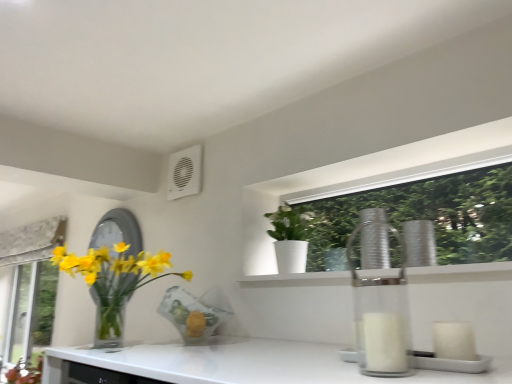
What is the approximate height of translucent glass vase at left, the 1th houseplant positioned from the left?

translucent glass vase at left, the 1th houseplant positioned from the left, is 12.51 inches in height.

You are a GUI agent. You are given a task and a screenshot of the screen. Output one action in this format:
    pyautogui.click(x=<x>, y=<y>)
    Task: Click on the translucent glass vase at left, the 1th houseplant positioned from the left
    
    Given the screenshot: What is the action you would take?
    pyautogui.click(x=114, y=278)

The image size is (512, 384). What are the coordinates of `white plastic air conditioning unit at upper center` in the screenshot? It's located at (184, 173).

Considering the relative sizes of white matte pot at upper center, marked as the second houseplant in a left-to-right arrangement, and translucent glass vase at left, the 1th houseplant positioned from the left, in the image provided, is white matte pot at upper center, marked as the second houseplant in a left-to-right arrangement, smaller than translucent glass vase at left, the 1th houseplant positioned from the left,?

Yes.

How far apart are white matte pot at upper center, which ranks as the 1th houseplant in right-to-left order, and translucent glass vase at left, positioned as the 2th houseplant in right-to-left order?

white matte pot at upper center, which ranks as the 1th houseplant in right-to-left order, is 54.74 centimeters away from translucent glass vase at left, positioned as the 2th houseplant in right-to-left order.

Consider the image. Is white matte pot at upper center, which ranks as the 1th houseplant in right-to-left order, next to translucent glass vase at left, the 1th houseplant positioned from the left?

No, white matte pot at upper center, which ranks as the 1th houseplant in right-to-left order, is not with translucent glass vase at left, the 1th houseplant positioned from the left.

From the image's perspective, between white matte pot at upper center, marked as the second houseplant in a left-to-right arrangement, and translucent glass vase at left, the 1th houseplant positioned from the left, which one is located above?

From the image's view, white matte pot at upper center, marked as the second houseplant in a left-to-right arrangement, is above.

Looking at this image, which is closer, [113,221] or [184,166]?

Point [113,221].

Is silver metallic mirror at left oriented towards white plastic air conditioning unit at upper center?

No, silver metallic mirror at left is not oriented towards white plastic air conditioning unit at upper center.

Considering the sizes of objects silver metallic mirror at left and white plastic air conditioning unit at upper center in the image provided, who is wider, silver metallic mirror at left or white plastic air conditioning unit at upper center?

silver metallic mirror at left is wider.

From the picture: How distant is silver metallic mirror at left from white plastic air conditioning unit at upper center?

silver metallic mirror at left and white plastic air conditioning unit at upper center are 43.72 centimeters apart from each other.

How many degrees apart are the facing directions of white matte pot at upper center, marked as the second houseplant in a left-to-right arrangement, and white plastic air conditioning unit at upper center?

There is a 0.00695-degree angle between the facing directions of white matte pot at upper center, marked as the second houseplant in a left-to-right arrangement, and white plastic air conditioning unit at upper center.

Is white matte pot at upper center, marked as the second houseplant in a left-to-right arrangement, at the right side of white plastic air conditioning unit at upper center?

Yes.

Is white matte pot at upper center, which ranks as the 1th houseplant in right-to-left order, facing towards white plastic air conditioning unit at upper center?

No, white matte pot at upper center, which ranks as the 1th houseplant in right-to-left order, is not facing towards white plastic air conditioning unit at upper center.

How many degrees apart are the facing directions of translucent glass vase at left, the 1th houseplant positioned from the left, and white plastic air conditioning unit at upper center?

They differ by 0.00631 degrees in their facing directions.

In terms of width, does translucent glass vase at left, positioned as the 2th houseplant in right-to-left order, look wider or thinner when compared to white plastic air conditioning unit at upper center?

translucent glass vase at left, positioned as the 2th houseplant in right-to-left order, is wider than white plastic air conditioning unit at upper center.

In the scene shown: Would you say translucent glass vase at left, positioned as the 2th houseplant in right-to-left order, contains white plastic air conditioning unit at upper center?

No, white plastic air conditioning unit at upper center is not inside translucent glass vase at left, positioned as the 2th houseplant in right-to-left order.

From the image's perspective, is translucent glass vase at left, positioned as the 2th houseplant in right-to-left order, under white plastic air conditioning unit at upper center?

Yes, from the image's perspective, translucent glass vase at left, positioned as the 2th houseplant in right-to-left order, is beneath white plastic air conditioning unit at upper center.

From the image's perspective, which is above, silver metallic mirror at left or white matte pot at upper center, which ranks as the 1th houseplant in right-to-left order?

white matte pot at upper center, which ranks as the 1th houseplant in right-to-left order, appears higher in the image.

Locate an element on the screen. houseplant that appears above the silver metallic mirror at left (from a real-world perspective) is located at coordinates (292, 236).

Considering the positions of objects silver metallic mirror at left and white matte pot at upper center, which ranks as the 1th houseplant in right-to-left order, in the image provided, who is more to the left, silver metallic mirror at left or white matte pot at upper center, which ranks as the 1th houseplant in right-to-left order,?

From the viewer's perspective, silver metallic mirror at left appears more on the left side.

Would you say silver metallic mirror at left is a long distance from white matte pot at upper center, which ranks as the 1th houseplant in right-to-left order?

Actually, silver metallic mirror at left and white matte pot at upper center, which ranks as the 1th houseplant in right-to-left order, are a little close together.

Which of these two, white plastic air conditioning unit at upper center or white matte pot at upper center, marked as the second houseplant in a left-to-right arrangement, stands taller?

white matte pot at upper center, marked as the second houseplant in a left-to-right arrangement, is taller.

Considering the sizes of objects white plastic air conditioning unit at upper center and white matte pot at upper center, which ranks as the 1th houseplant in right-to-left order, in the image provided, who is smaller, white plastic air conditioning unit at upper center or white matte pot at upper center, which ranks as the 1th houseplant in right-to-left order,?

white plastic air conditioning unit at upper center.

Is white plastic air conditioning unit at upper center facing away from white matte pot at upper center, marked as the second houseplant in a left-to-right arrangement?

No.

Between white plastic air conditioning unit at upper center and white matte pot at upper center, which ranks as the 1th houseplant in right-to-left order, which one appears on the right side from the viewer's perspective?

white matte pot at upper center, which ranks as the 1th houseplant in right-to-left order.

Do you think white plastic air conditioning unit at upper center is within translucent glass vase at left, the 1th houseplant positioned from the left, or outside of it?

white plastic air conditioning unit at upper center exists outside the volume of translucent glass vase at left, the 1th houseplant positioned from the left.

In order to click on the 2nd houseplant positioned below the white plastic air conditioning unit at upper center (from the image's perspective) in this screenshot , I will do `click(114, 278)`.

Considering the positions of objects white plastic air conditioning unit at upper center and translucent glass vase at left, positioned as the 2th houseplant in right-to-left order, in the image provided, who is more to the right, white plastic air conditioning unit at upper center or translucent glass vase at left, positioned as the 2th houseplant in right-to-left order,?

From the viewer's perspective, white plastic air conditioning unit at upper center appears more on the right side.

Are white plastic air conditioning unit at upper center and translucent glass vase at left, positioned as the 2th houseplant in right-to-left order, beside each other?

white plastic air conditioning unit at upper center and translucent glass vase at left, positioned as the 2th houseplant in right-to-left order, are not in contact.

Where is `houseplant located above the translucent glass vase at left, positioned as the 2th houseplant in right-to-left order (from the image's perspective)`? The width and height of the screenshot is (512, 384). houseplant located above the translucent glass vase at left, positioned as the 2th houseplant in right-to-left order (from the image's perspective) is located at coordinates (292, 236).

At what (x,y) coordinates should I click in order to perform the action: click on mirror lying below the white plastic air conditioning unit at upper center (from the image's perspective). Please return your answer as a coordinate pair (x, y). The image size is (512, 384). Looking at the image, I should click on (118, 231).

When comparing their distances from silver metallic mirror at left, does translucent glass vase at left, the 1th houseplant positioned from the left, or white matte pot at upper center, marked as the second houseplant in a left-to-right arrangement, seem further?

white matte pot at upper center, marked as the second houseplant in a left-to-right arrangement.

Based on their spatial positions, is silver metallic mirror at left or translucent glass vase at left, positioned as the 2th houseplant in right-to-left order, closer to white plastic air conditioning unit at upper center?

silver metallic mirror at left.

Estimate the real-world distances between objects in this image. Which object is closer to white plastic air conditioning unit at upper center, white matte pot at upper center, which ranks as the 1th houseplant in right-to-left order, or silver metallic mirror at left?

silver metallic mirror at left is closer to white plastic air conditioning unit at upper center.

From the image, which object appears to be farther from white plastic air conditioning unit at upper center, silver metallic mirror at left or white matte pot at upper center, which ranks as the 1th houseplant in right-to-left order?

Based on the image, white matte pot at upper center, which ranks as the 1th houseplant in right-to-left order, appears to be further to white plastic air conditioning unit at upper center.

Looking at this image, looking at the image, which one is located closer to white plastic air conditioning unit at upper center, translucent glass vase at left, positioned as the 2th houseplant in right-to-left order, or silver metallic mirror at left?

silver metallic mirror at left lies closer to white plastic air conditioning unit at upper center than the other object.

Considering their positions, is white plastic air conditioning unit at upper center positioned further to translucent glass vase at left, positioned as the 2th houseplant in right-to-left order, than white matte pot at upper center, which ranks as the 1th houseplant in right-to-left order?

The object further to translucent glass vase at left, positioned as the 2th houseplant in right-to-left order, is white matte pot at upper center, which ranks as the 1th houseplant in right-to-left order.

Which object lies nearer to the anchor point translucent glass vase at left, positioned as the 2th houseplant in right-to-left order, silver metallic mirror at left or white matte pot at upper center, marked as the second houseplant in a left-to-right arrangement?

silver metallic mirror at left is closer to translucent glass vase at left, positioned as the 2th houseplant in right-to-left order.

Based on their spatial positions, is white plastic air conditioning unit at upper center or white matte pot at upper center, marked as the second houseplant in a left-to-right arrangement, closer to silver metallic mirror at left?

white plastic air conditioning unit at upper center.

You are a GUI agent. You are given a task and a screenshot of the screen. Output one action in this format:
    pyautogui.click(x=<x>, y=<y>)
    Task: Click on the air conditioning positioned between translucent glass vase at left, positioned as the 2th houseplant in right-to-left order, and silver metallic mirror at left from near to far
    The height and width of the screenshot is (384, 512).
    Given the screenshot: What is the action you would take?
    pyautogui.click(x=184, y=173)

The image size is (512, 384). I want to click on air conditioning located between silver metallic mirror at left and white matte pot at upper center, which ranks as the 1th houseplant in right-to-left order, in the left-right direction, so click(184, 173).

This screenshot has height=384, width=512. Identify the location of houseplant positioned between translucent glass vase at left, positioned as the 2th houseplant in right-to-left order, and white plastic air conditioning unit at upper center from near to far. (292, 236).

Where is `houseplant positioned between translucent glass vase at left, the 1th houseplant positioned from the left, and silver metallic mirror at left from near to far`? This screenshot has width=512, height=384. houseplant positioned between translucent glass vase at left, the 1th houseplant positioned from the left, and silver metallic mirror at left from near to far is located at coordinates (292, 236).